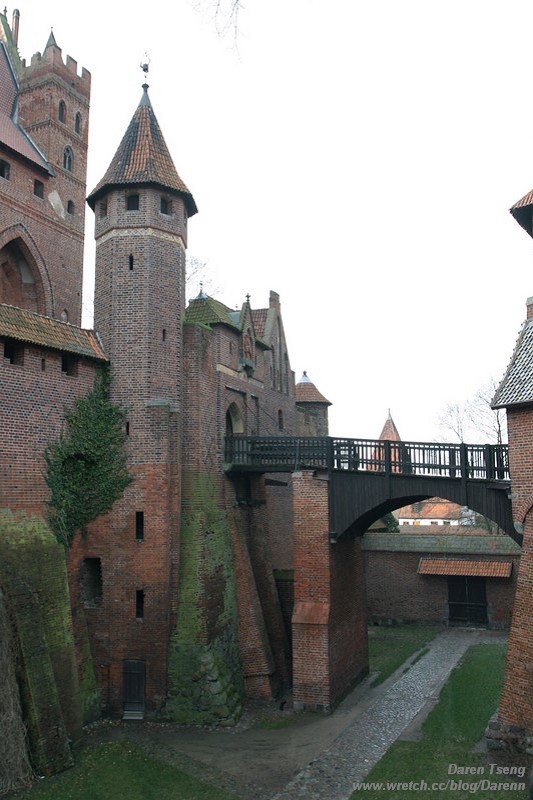
Locate an element on the screen. The image size is (533, 800). steps is located at coordinates (133, 713).